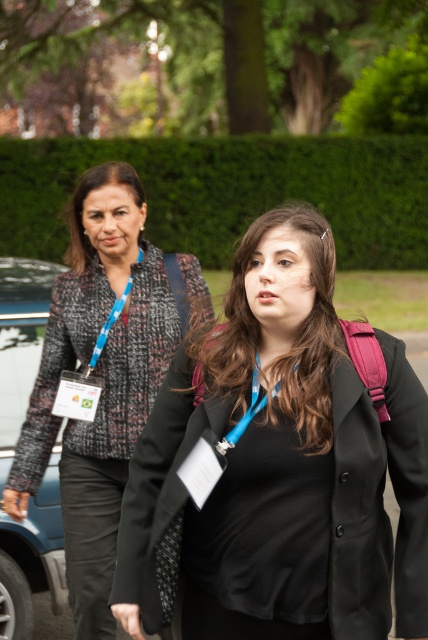
Is point (183, 269) farther from viewer compared to point (74, 266)?

No, it is in front of (74, 266).

Describe the element at coordinates (98, 378) in the screenshot. The image size is (428, 640). I see `speckled tweed blazer at left` at that location.

Locate an element on the screen. The image size is (428, 640). speckled tweed blazer at left is located at coordinates pyautogui.click(x=98, y=378).

Between speckled tweed blazer at left and blue fabric lanyard at upper left, which one has more height?

With more height is speckled tweed blazer at left.

Image resolution: width=428 pixels, height=640 pixels. What do you see at coordinates (98, 378) in the screenshot? I see `speckled tweed blazer at left` at bounding box center [98, 378].

The width and height of the screenshot is (428, 640). In order to click on speckled tweed blazer at left in this screenshot , I will do `click(98, 378)`.

Which is more to the right, matte black jacket at upper left or blue fabric lanyard at center?

blue fabric lanyard at center is more to the right.

Does point (86, 195) come behind point (255, 356)?

Yes, it is behind point (255, 356).

Describe the element at coordinates (83, 208) in the screenshot. The height and width of the screenshot is (640, 428). I see `matte black jacket at upper left` at that location.

I want to click on matte black jacket at upper left, so click(x=83, y=208).